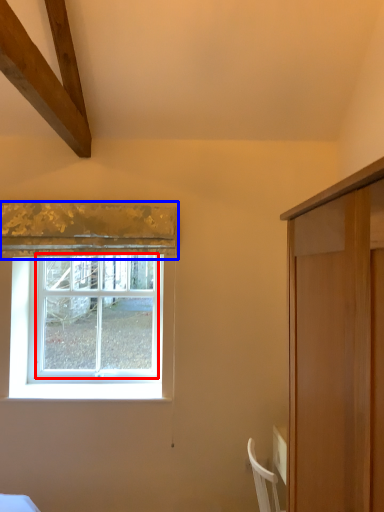
Question: Which point is closer to the camera, window (highlighted by a red box) or curtain (highlighted by a blue box)?

Choices:
 (A) window
 (B) curtain

Answer: (B)